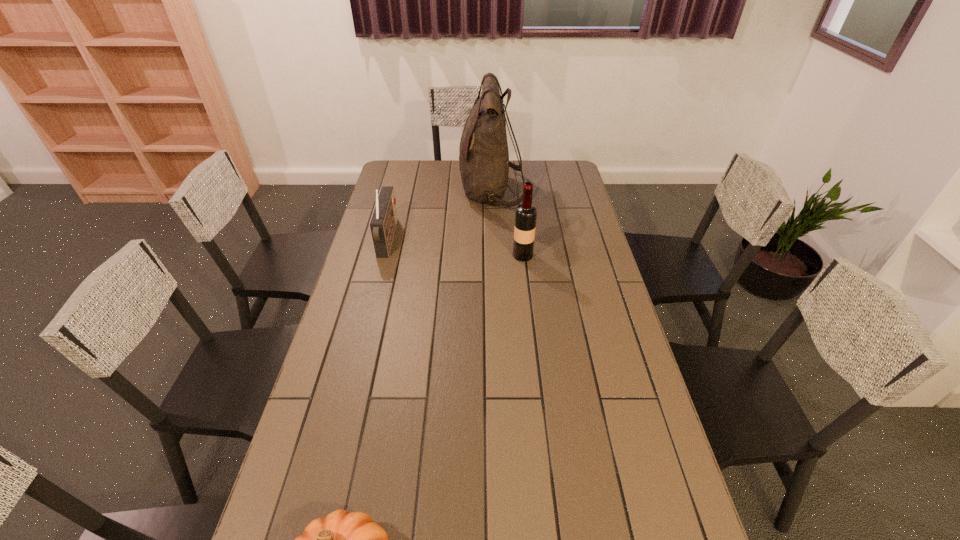
Where is `the farthest object`? This screenshot has height=540, width=960. the farthest object is located at coordinates (484, 161).

Image resolution: width=960 pixels, height=540 pixels. What are the coordinates of `the tallest object` in the screenshot? It's located at (484, 161).

This screenshot has height=540, width=960. Identify the location of the third shortest object. (525, 216).

I want to click on the second shortest object, so click(383, 222).

Locate an element on the screen. vacant space located on the open flap of the backpack is located at coordinates (446, 191).

Find the location of a particular element. The image size is (960, 540). vacant point located 0.330m on the open flap of the backpack is located at coordinates (387, 191).

I want to click on free space located 0.160m on the open flap of the backpack, so click(424, 191).

The width and height of the screenshot is (960, 540). I want to click on free space located on the right of the wine bottle, so click(x=573, y=255).

Locate an element on the screen. Image resolution: width=960 pixels, height=540 pixels. vacant space located on the front panel of the third tallest object is located at coordinates (474, 239).

Where is `object that is at the far edge`? object that is at the far edge is located at coordinates (484, 161).